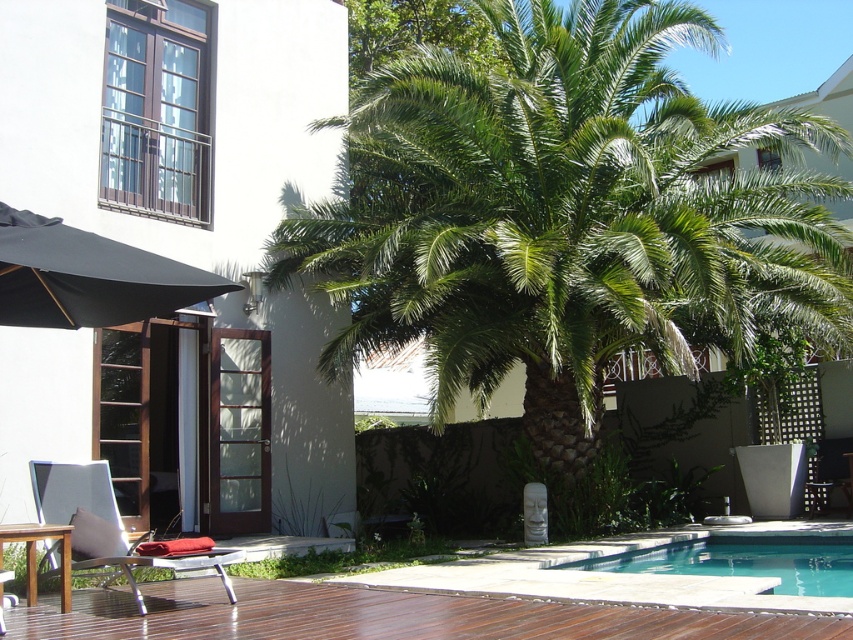
Which is in front, point (22, 285) or point (80, 509)?

Positioned in front is point (22, 285).

Does black fabric umbrella at left have a larger size compared to metallic silver chair at lower left?

Yes.

Is point (25, 252) positioned in front of point (103, 532)?

Yes, it is in front of point (103, 532).

What are the coordinates of `black fabric umbrella at left` in the screenshot? It's located at (88, 276).

Can you confirm if dark brown wood deck at lower center is positioned to the left of metallic silver chair at lower left?

No, dark brown wood deck at lower center is not to the left of metallic silver chair at lower left.

This screenshot has width=853, height=640. What do you see at coordinates (381, 616) in the screenshot?
I see `dark brown wood deck at lower center` at bounding box center [381, 616].

Identify the location of dark brown wood deck at lower center. (381, 616).

Is dark brown wood deck at lower center further to camera compared to clear glass pool at lower right?

That is False.

Is dark brown wood deck at lower center to the left of clear glass pool at lower right from the viewer's perspective?

Correct, you'll find dark brown wood deck at lower center to the left of clear glass pool at lower right.

Is point (570, 602) behind point (695, 544)?

No, (570, 602) is closer to viewer.

Find the location of a particular element. This screenshot has height=640, width=853. dark brown wood deck at lower center is located at coordinates (381, 616).